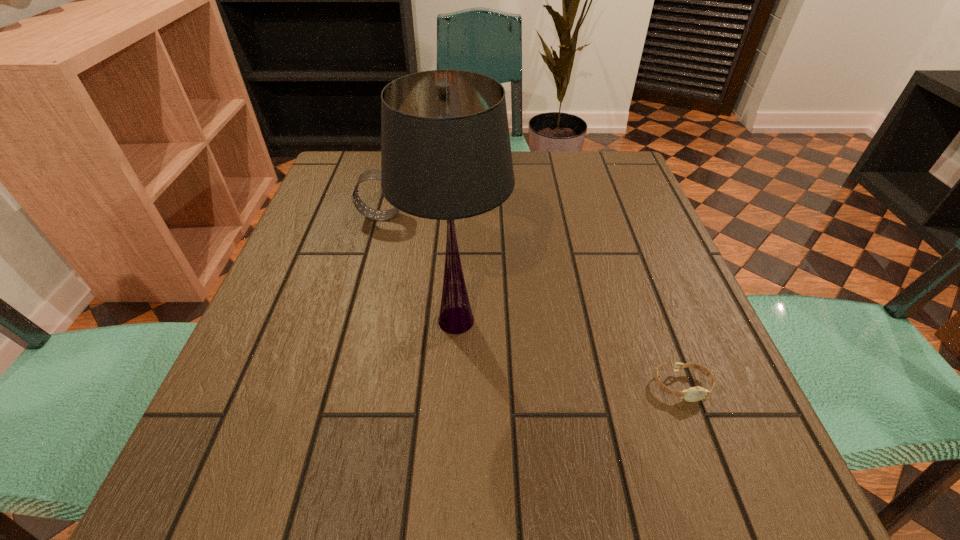
Find the location of a particular element. free space between the lampshade and the shortest object is located at coordinates (568, 353).

The image size is (960, 540). Identify the location of free space between the lampshade and the shortest object. 568,353.

Where is `free area in between the leftmost object and the tallest object`? The height and width of the screenshot is (540, 960). free area in between the leftmost object and the tallest object is located at coordinates (420, 268).

At what (x,y) coordinates should I click in order to perform the action: click on vacant space in between the farther watch and the lampshade. Please return your answer as a coordinate pair (x, y). The image size is (960, 540). Looking at the image, I should click on (420, 268).

This screenshot has height=540, width=960. In order to click on free point between the nearer watch and the tallest object in this screenshot , I will do coord(568,353).

Where is `unoccupied position between the taller watch and the second object from right to left`? This screenshot has width=960, height=540. unoccupied position between the taller watch and the second object from right to left is located at coordinates (420, 268).

This screenshot has height=540, width=960. I want to click on unoccupied area between the tallest object and the leftmost object, so click(420, 268).

Identify which object is located as the nearest to the lampshade. Please provide its 2D coordinates. Your answer should be formatted as a tuple, i.e. [(x, y)], where the tuple contains the x and y coordinates of a point satisfying the conditions above.

[(375, 174)]

Identify which object is the nearest to the farthest object. Please provide its 2D coordinates. Your answer should be formatted as a tuple, i.e. [(x, y)], where the tuple contains the x and y coordinates of a point satisfying the conditions above.

[(445, 146)]